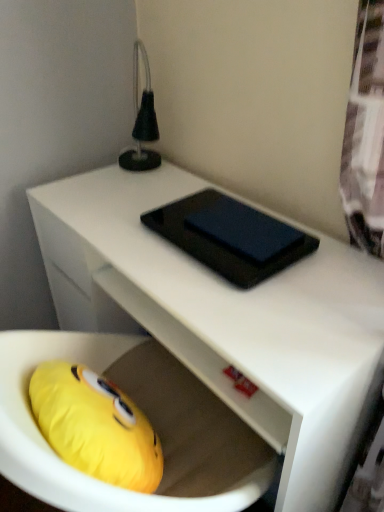
Locate an element on the screen. Image resolution: width=384 pixels, height=512 pixels. vacant region to the left of black glossy tablet at center is located at coordinates pos(129,236).